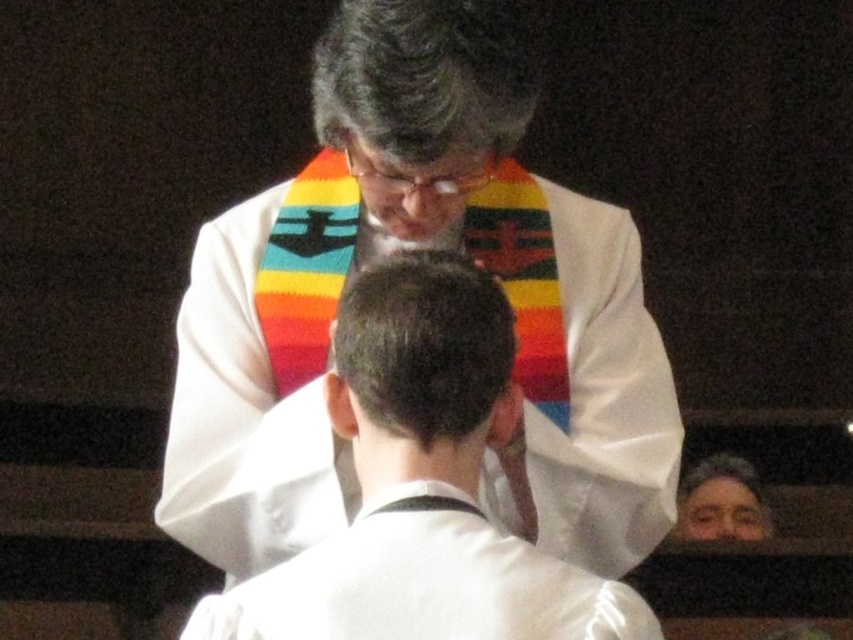
Is white satin robe at center behind brown hair at center?

That is False.

Is point (529, 560) less distant than point (381, 406)?

Yes, point (529, 560) is in front of point (381, 406).

Identify the location of white satin robe at center. This screenshot has width=853, height=640. (422, 582).

Between white satin robe at center and multicolored knitted scarf at center, which one has less height?

With less height is white satin robe at center.

Between white satin robe at center and multicolored knitted scarf at center, which one is positioned higher?

multicolored knitted scarf at center

Where is `white satin robe at center`? Image resolution: width=853 pixels, height=640 pixels. white satin robe at center is located at coordinates (422, 582).

Does multicolored knitted scarf at center have a lesser height compared to brown hair at center?

Incorrect, multicolored knitted scarf at center's height does not fall short of brown hair at center's.

Does point (424, 236) lie in front of point (369, 468)?

No, it is not.

Identify the location of multicolored knitted scarf at center. The image size is (853, 640). (422, 100).